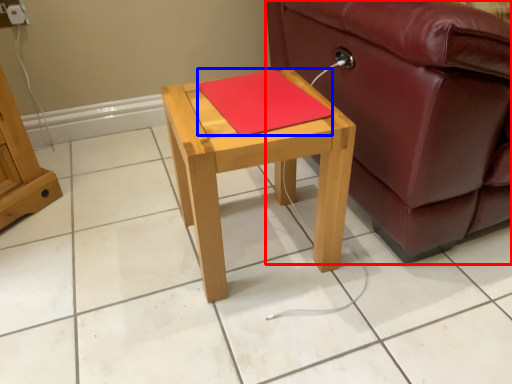
Question: Which of the following is the closest to the observer, studio couch (highlighted by a red box) or pad (highlighted by a blue box)?

Choices:
 (A) studio couch
 (B) pad

Answer: (A)